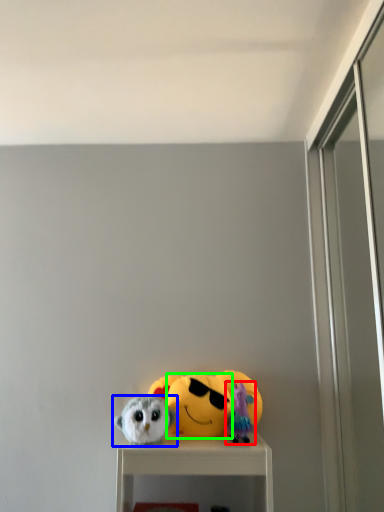
Question: Estimate the real-world distances between objects in this image. Which object is farther from toy (highlighted by a red box), toy (highlighted by a blue box) or face (highlighted by a green box)?

Choices:
 (A) toy
 (B) face

Answer: (A)